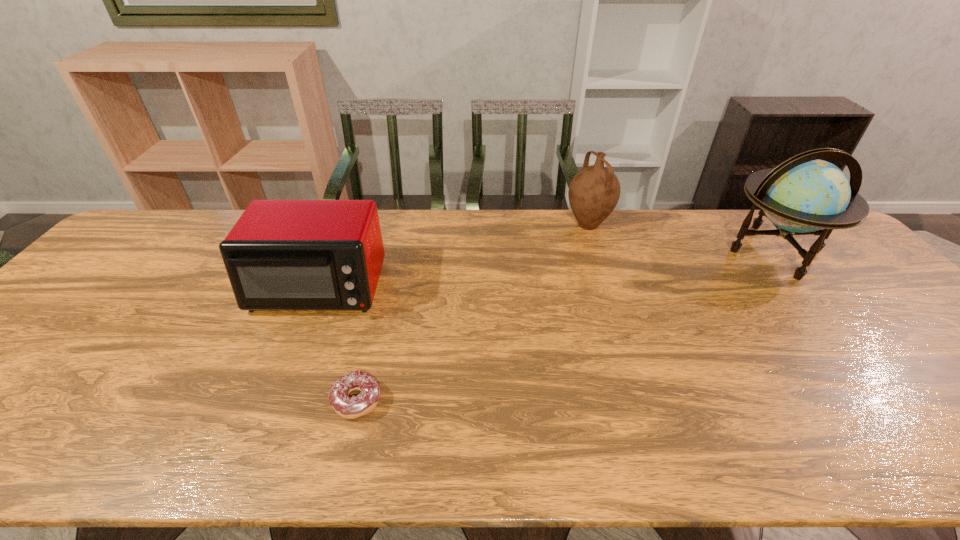
Find the location of `free space between the pitcher and the doughnut`. free space between the pitcher and the doughnut is located at coordinates (472, 313).

Where is `vacant area that lies between the second shortest object and the tallest object`? Image resolution: width=960 pixels, height=540 pixels. vacant area that lies between the second shortest object and the tallest object is located at coordinates (546, 269).

Find the location of a particular element. This screenshot has width=960, height=540. free spot between the shortest object and the rightmost object is located at coordinates (565, 326).

This screenshot has height=540, width=960. I want to click on free space between the globe and the second shortest object, so click(546, 269).

Locate an element on the screen. This screenshot has height=540, width=960. vacant area that lies between the rightmost object and the doughnut is located at coordinates (565, 326).

The height and width of the screenshot is (540, 960). In order to click on free spot between the second object from right to left and the second shortest object in this screenshot , I will do [453, 256].

This screenshot has height=540, width=960. What are the coordinates of `free space between the second object from right to left and the tallest object` in the screenshot? It's located at (682, 238).

I want to click on vacant area that lies between the third shortest object and the tallest object, so click(682, 238).

Identify the location of free space between the toaster oven and the third shortest object. Image resolution: width=960 pixels, height=540 pixels. (453, 256).

Identify which object is located as the second nearest to the tallest object. Please provide its 2D coordinates. Your answer should be formatted as a tuple, i.e. [(x, y)], where the tuple contains the x and y coordinates of a point satisfying the conditions above.

[(347, 407)]